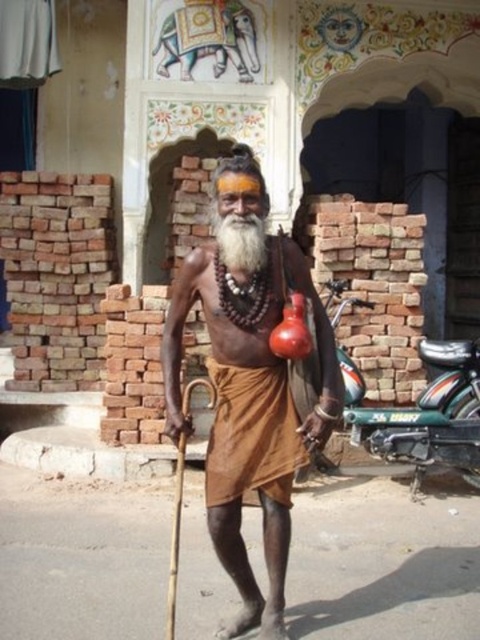
Measure the distance between point (267,432) and camera.

Point (267,432) is 2.96 meters away from camera.

Between point (277, 262) and point (210, 371), which one is positioned behind?

Positioned behind is point (210, 371).

Image resolution: width=480 pixels, height=640 pixels. Identify the location of brown matte cloth at center. (251, 412).

Based on the photo, which of these two, green metallic motorcycle at lower right or brown cotton dhoti at center, stands shorter?

brown cotton dhoti at center is shorter.

Identify the location of green metallic motorcycle at lower right. The width and height of the screenshot is (480, 640). (422, 413).

Does brown matte cloth at center appear over green metallic motorcycle at lower right?

Yes, brown matte cloth at center is above green metallic motorcycle at lower right.

Who is shorter, brown matte cloth at center or green metallic motorcycle at lower right?

green metallic motorcycle at lower right

Where is `brown matte cloth at center`? Image resolution: width=480 pixels, height=640 pixels. brown matte cloth at center is located at coordinates (251, 412).

Find the location of `brown matte cloth at center`. brown matte cloth at center is located at coordinates (251, 412).